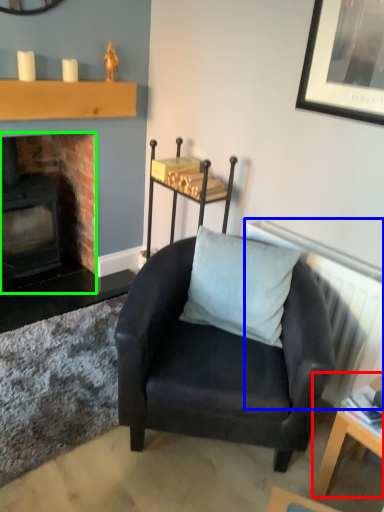
Question: Estimate the real-world distances between objects in this image. Which object is closer to table (highlighted by a red box), radiator (highlighted by a blue box) or fireplace (highlighted by a green box)?

Choices:
 (A) radiator
 (B) fireplace

Answer: (A)